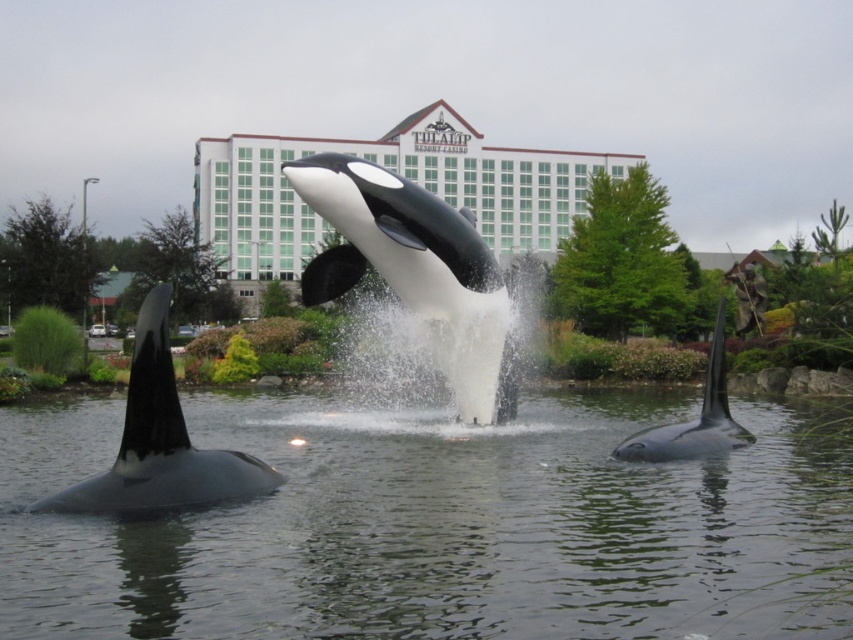
Looking at this image, who is taller, black and white plastic orca at center or black matte orca at left?

With more height is black and white plastic orca at center.

Is black and white plastic orca at center behind black matte orca at left?

That is True.

This screenshot has height=640, width=853. I want to click on black and white plastic orca at center, so click(x=415, y=269).

Between point (519, 556) and point (123, 476), which one is positioned in front?

Positioned in front is point (519, 556).

The width and height of the screenshot is (853, 640). What are the coordinates of `clear water at center` in the screenshot? It's located at (438, 525).

Is the position of clear water at center less distant than that of black matte orca at right?

Yes, clear water at center is closer to the viewer.

Is clear water at center to the right of black matte orca at right from the viewer's perspective?

No, clear water at center is not to the right of black matte orca at right.

Is point (828, 545) positioned behind point (717, 400)?

No, (828, 545) is in front of (717, 400).

The height and width of the screenshot is (640, 853). Identify the location of clear water at center. (438, 525).